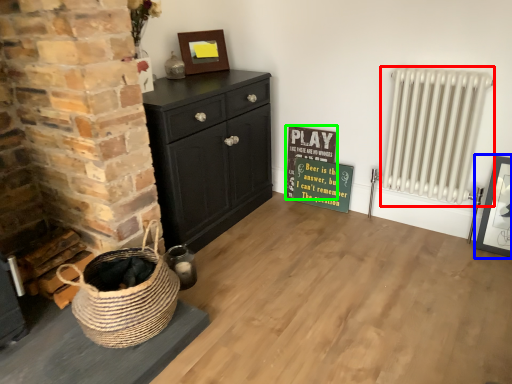
Question: Which object is positioned closest to radiator (highlighted by a red box)? Select from picture frame (highlighted by a blue box) and bulletin board (highlighted by a green box).

Choices:
 (A) picture frame
 (B) bulletin board

Answer: (A)